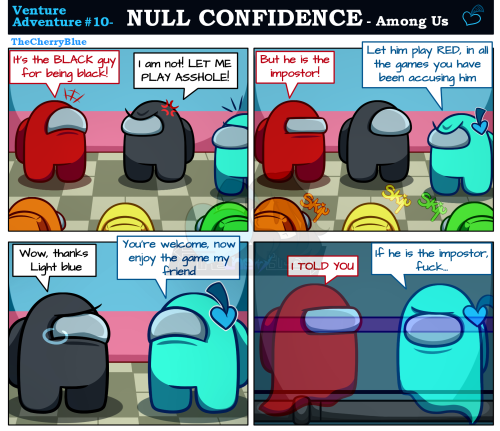
Locate an element on the screen. checkered floor is located at coordinates (102, 191), (344, 198), (126, 408).